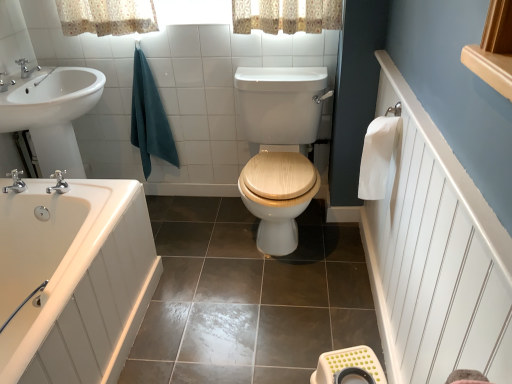
This screenshot has height=384, width=512. Find the location of `free region on the left part of wooden at center`. free region on the left part of wooden at center is located at coordinates (194, 243).